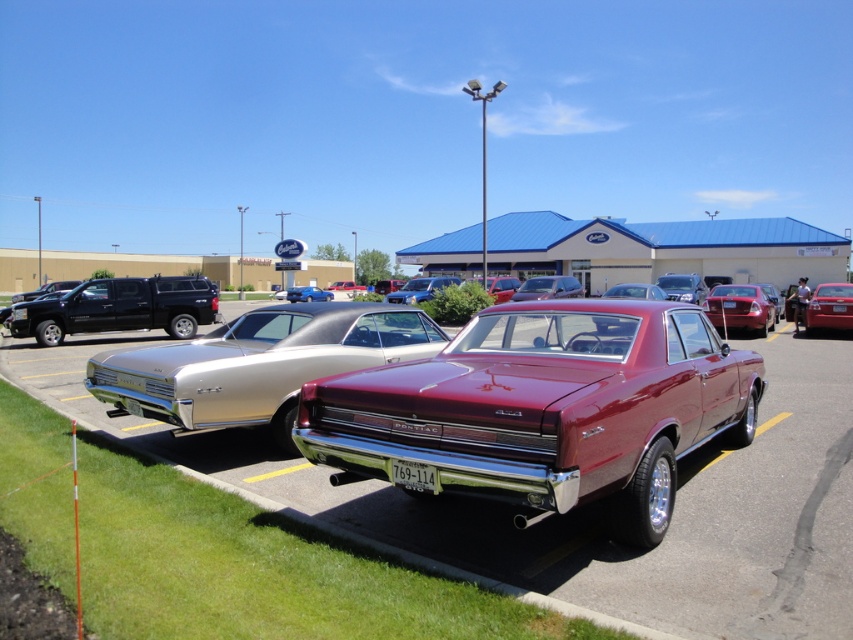
Question: Can you confirm if metallic gold sedan at center is positioned to the left of satin black sedan at center?

Choices:
 (A) yes
 (B) no

Answer: (B)

Question: Is metallic silver car at center smaller than glossy blue sedan at center?

Choices:
 (A) yes
 (B) no

Answer: (B)

Question: Is metallic silver car at center to the right of glossy blue sedan at center from the viewer's perspective?

Choices:
 (A) no
 (B) yes

Answer: (A)

Question: Among these objects, which one is nearest to the camera?

Choices:
 (A) metallic gold sedan at center
 (B) glossy metallic sedan at right

Answer: (A)

Question: Among these objects, which one is farthest from the camera?

Choices:
 (A) shiny maroon sedan at center
 (B) glossy metallic sedan at right

Answer: (B)

Question: Which point is closer to the camera?

Choices:
 (A) (296, 289)
 (B) (750, 292)
 (C) (131, 301)

Answer: (C)